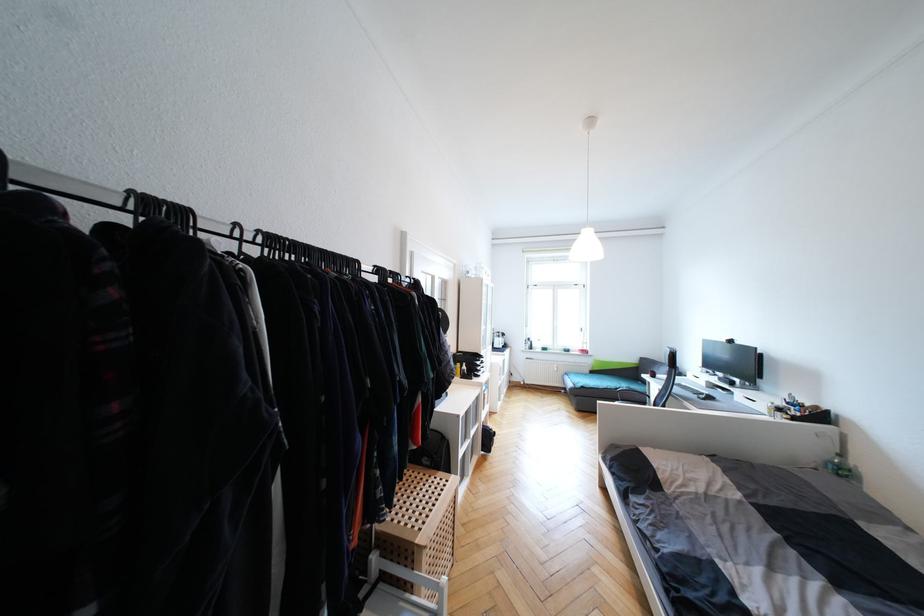
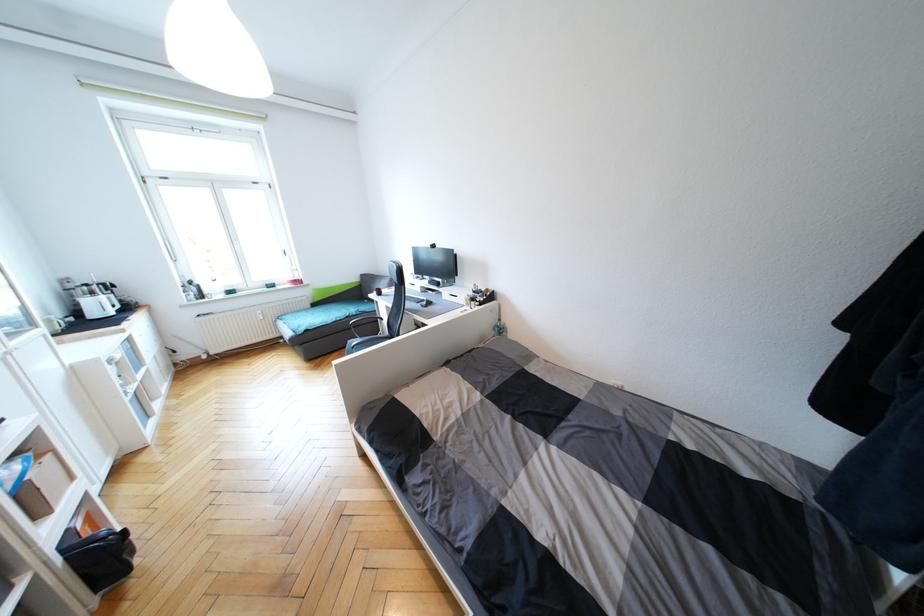
Locate, in the second image, the point that corresponds to (x=596, y=373) in the first image.

(319, 306)